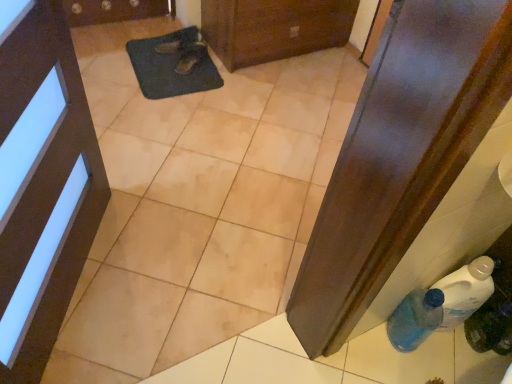
Question: Considering the positions of blue translucent bottle at lower right, positioned as the second bottle in left-to-right order, and brown wooden door at upper center, which ranks as the 1th door in top-to-bottom order, in the image, is blue translucent bottle at lower right, positioned as the second bottle in left-to-right order, wider or thinner than brown wooden door at upper center, which ranks as the 1th door in top-to-bottom order,?

Choices:
 (A) wide
 (B) thin

Answer: (B)

Question: Is point (472, 336) positioned closer to the camera than point (253, 28)?

Choices:
 (A) closer
 (B) farther

Answer: (A)

Question: Estimate the real-world distances between objects in this image. Which object is closer to the brown leather shoe at center, the 2th footwear in the top-to-bottom sequence?

Choices:
 (A) brown wooden door at upper center, which is the 2th door in bottom-to-top order
 (B) blue translucent bottle at lower right, positioned as the second bottle in left-to-right order
 (C) black leather shoe at upper center, positioned as the second footwear in bottom-to-top order
 (D) matte black door at upper left, marked as the 2th door in a back-to-front arrangement
 (E) dark blue textured mat at center

Answer: (C)

Question: Which is nearer to the brown leather shoe at center, the 2th footwear in the top-to-bottom sequence?

Choices:
 (A) matte black door at upper left, which is the first door from bottom to top
 (B) brown wooden door at upper center, the second door viewed from the left
 (C) dark blue textured mat at center
 (D) blue translucent bottle at lower right, positioned as the second bottle in left-to-right order
 (E) blue translucent bottle at lower right, the 2th bottle positioned from the right

Answer: (C)